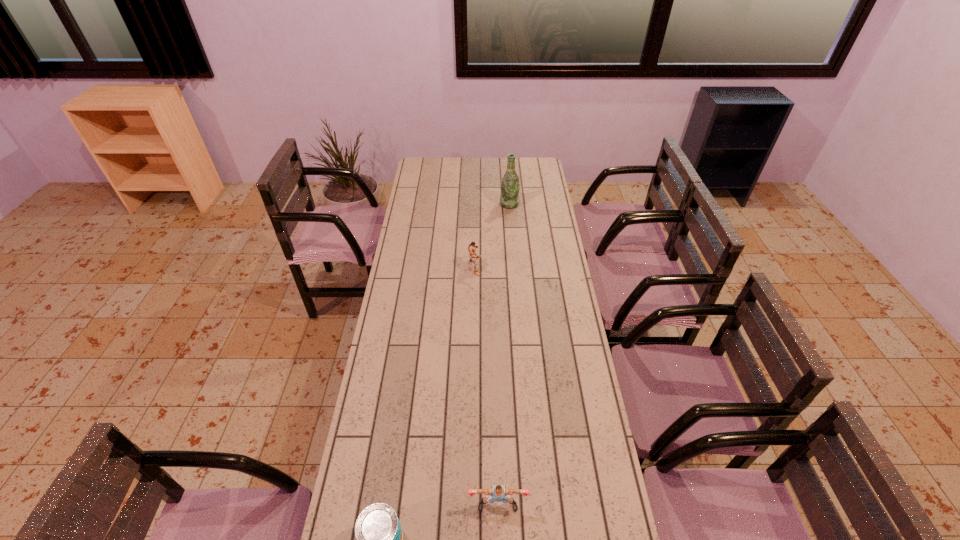
I want to click on free space that satisfies the following two spatial constraints: 1. on the surface of the beer bottle; 2. on the front-facing side of the second farthest object, so click(x=515, y=267).

Identify the location of free region that satisfies the following two spatial constraints: 1. on the surface of the tallest object; 2. on the front-facing side of the second farthest object. (515, 267).